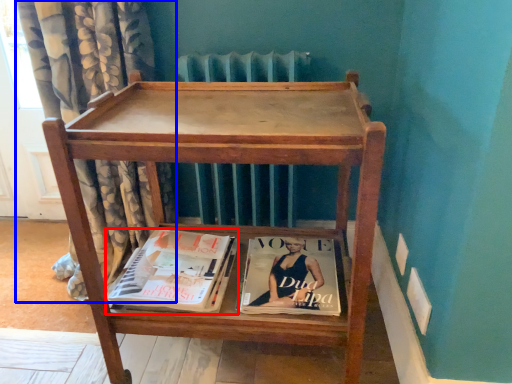
Question: Which point is further to the camera, book (highlighted by a red box) or curtain (highlighted by a blue box)?

Choices:
 (A) book
 (B) curtain

Answer: (A)